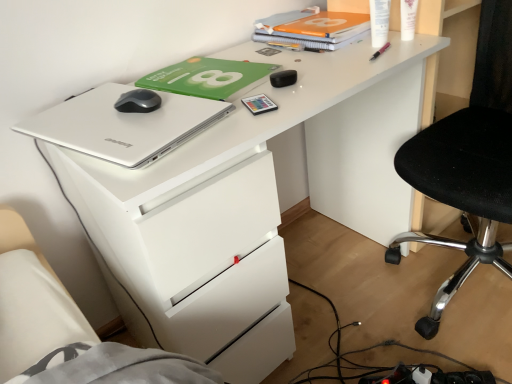
Question: From a real-world perspective, relative to orange matte notebook at upper center, is pink plastic pen at upper right, the 3th stationery positioned from the left, vertically above or below?

Choices:
 (A) below
 (B) above

Answer: (A)

Question: Based on their positions, is pink plastic pen at upper right, which is the 3th stationery from bottom to top, located to the left or right of orange matte notebook at upper center?

Choices:
 (A) left
 (B) right

Answer: (B)

Question: Estimate the real-world distances between objects in this image. Which object is closer to the satin black mouse at upper left?

Choices:
 (A) green matte paperback book at upper center
 (B) black mesh chair at right
 (C) silver metallic laptop at upper left
 (D) white glossy lotion at upper right, the first stationery when ordered from right to left
 (E) orange matte notebook at upper center

Answer: (C)

Question: Which of these objects is positioned closest to the black matte earbuds at center, the fourth stationery viewed from the top?

Choices:
 (A) satin black mouse at upper left
 (B) orange matte notebook at upper center
 (C) green matte paperback book at upper center
 (D) black mesh chair at right
 (E) white plastic bottle at upper right, which is the fourth stationery from left to right

Answer: (C)